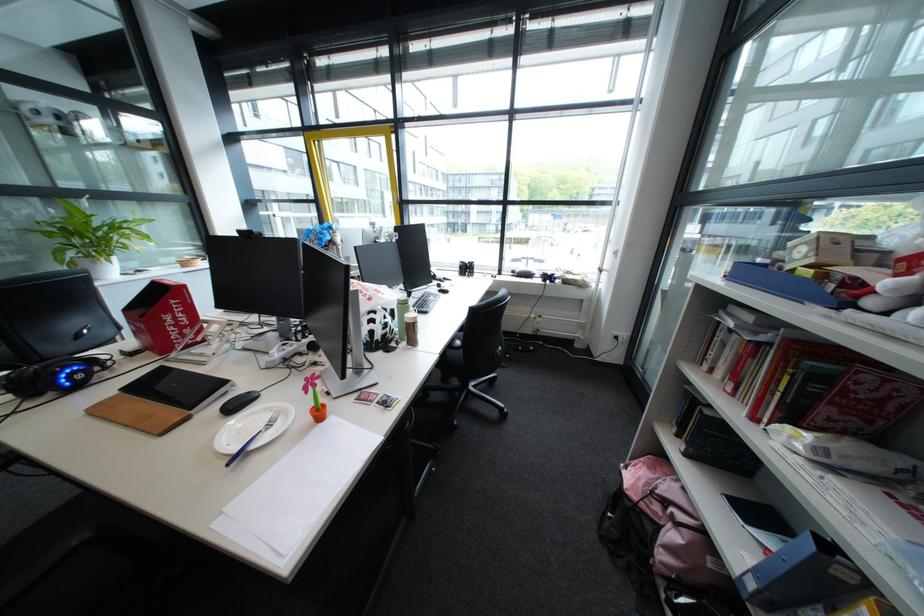
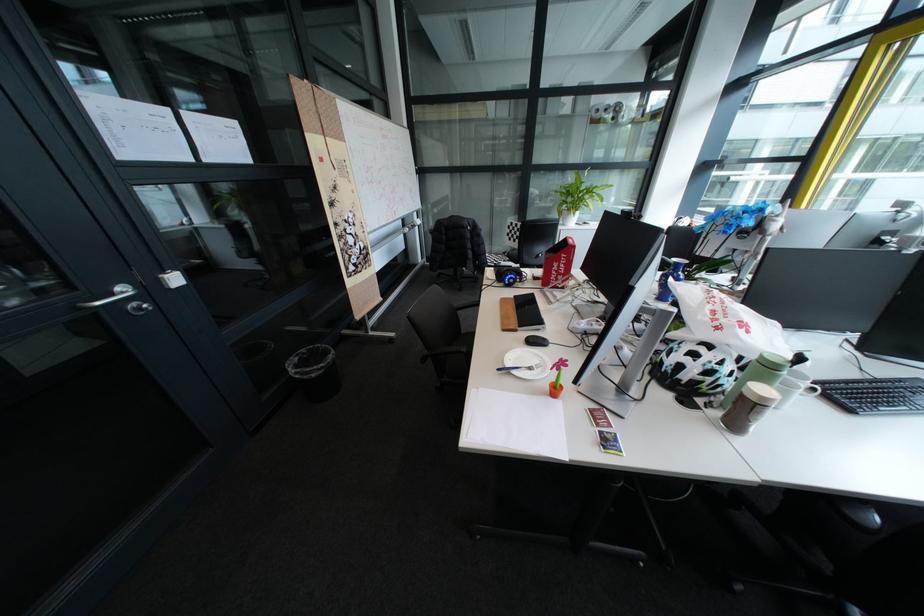
Where in the second image is the point corresponding to pixel 315 435 from the first image?

(551, 392)